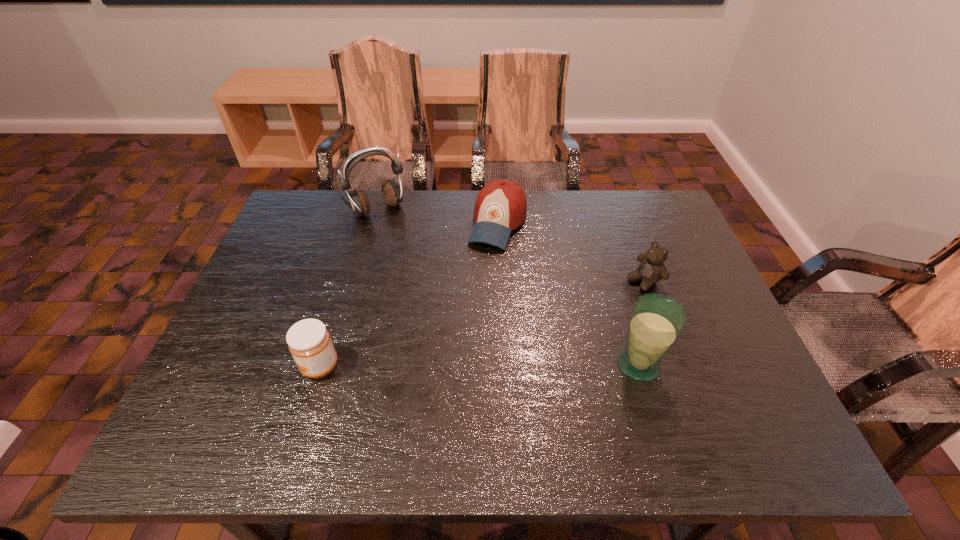
The width and height of the screenshot is (960, 540). I want to click on vacant space on the desktop that is between the jam and the glass and is positioned on the face of the third nearest object, so click(x=502, y=365).

The image size is (960, 540). What are the coordinates of `vacant space on the desktop that is between the jam and the glass and is positioned on the front-facing side of the baseball cap` in the screenshot? It's located at (435, 366).

Image resolution: width=960 pixels, height=540 pixels. Identify the location of free space on the desktop that is between the jam and the fourth shortest object and is positioned on the ear pads of the earphone. (492, 365).